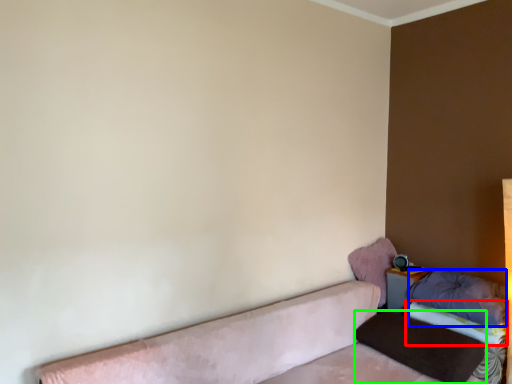
Question: Estimate the real-world distances between objects in this image. Which object is farther from sheet (highlighted by a red box), pillow (highlighted by a blue box) or pillow (highlighted by a green box)?

Choices:
 (A) pillow
 (B) pillow

Answer: (B)